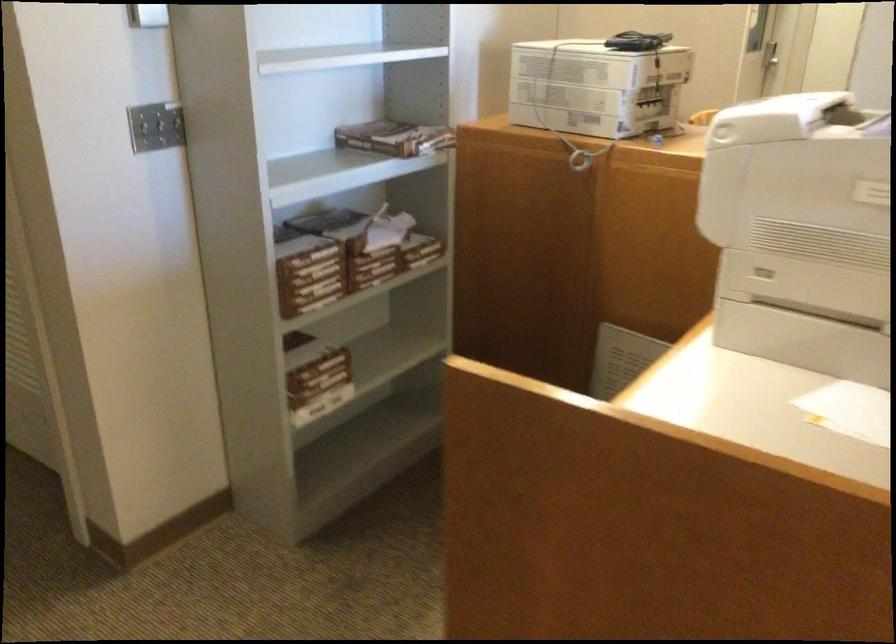
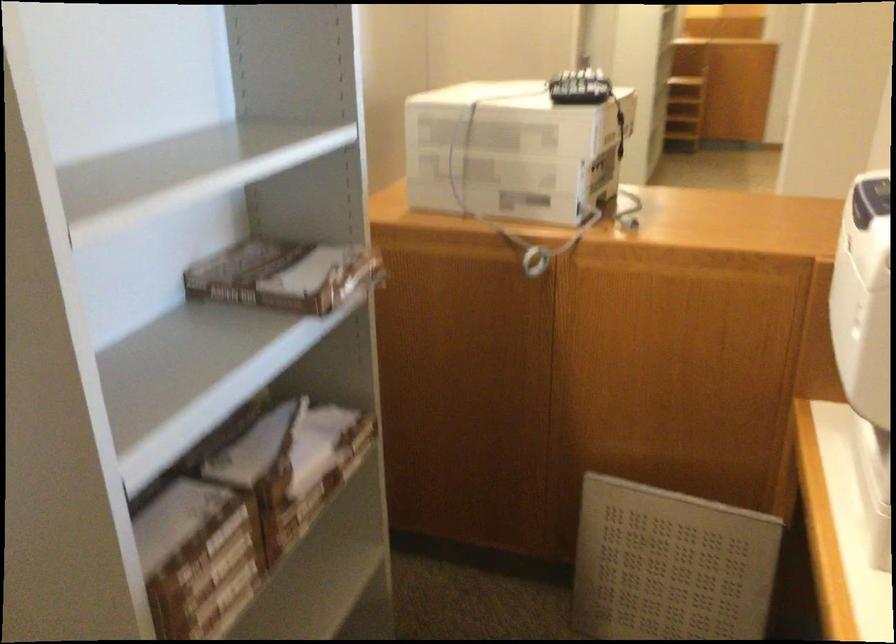
The point at (392, 131) is marked in the first image. Where is the corresponding point in the second image?

(280, 275)